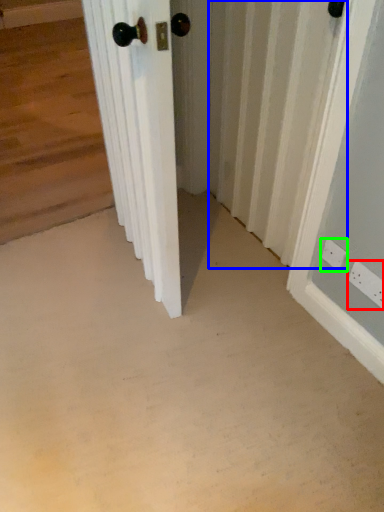
Question: Which object is the farthest from electric outlet (highlighted by a red box)? Choose among these: radiator (highlighted by a blue box) or electric outlet (highlighted by a green box).

Choices:
 (A) radiator
 (B) electric outlet

Answer: (A)